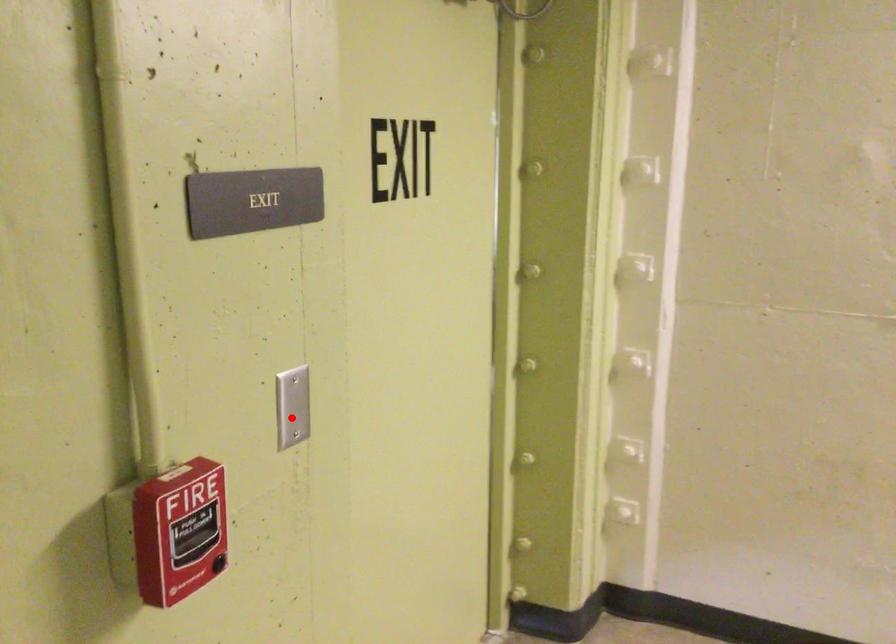
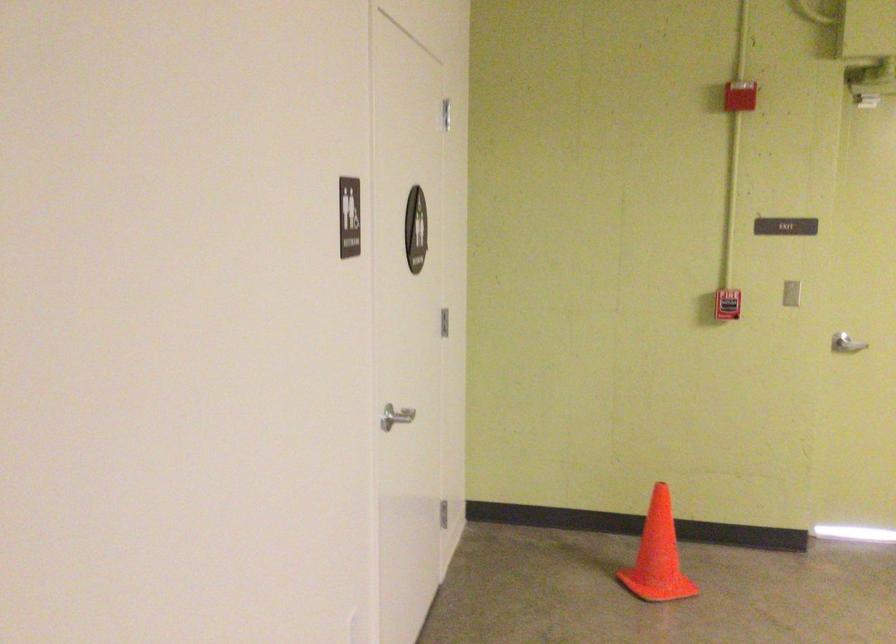
Where in the second image is the point corresponding to the highlighted location from the first image?

(790, 292)